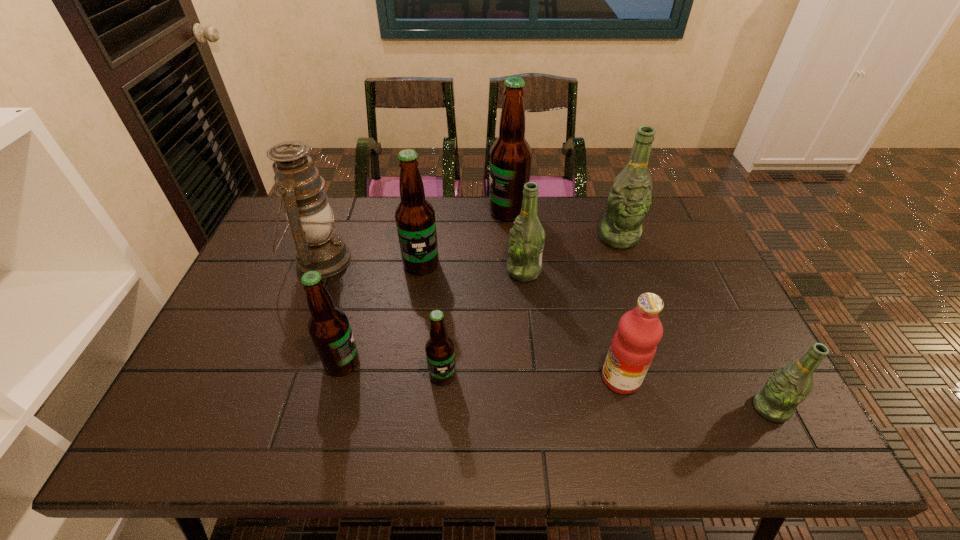
Find the location of a particular element. This screenshot has width=960, height=540. vacant region located 0.270m on the surface of the nearest green beer bottle is located at coordinates (635, 408).

Locate an element on the screen. The image size is (960, 540). free location located on the surface of the nearest green beer bottle is located at coordinates (691, 408).

Image resolution: width=960 pixels, height=540 pixels. I want to click on free space located on the surface of the nearest green beer bottle, so click(x=616, y=408).

Where is `oil lamp at the far edge`? oil lamp at the far edge is located at coordinates (298, 183).

I want to click on object that is at the near edge, so click(x=789, y=385).

The width and height of the screenshot is (960, 540). Find the location of `object located in the left edge section of the desktop`. object located in the left edge section of the desktop is located at coordinates (298, 183).

Locate an element on the screen. The width and height of the screenshot is (960, 540). object at the right edge is located at coordinates (789, 385).

Identify the location of object that is at the far left corner. (298, 183).

I want to click on object positioned at the near right corner, so click(x=789, y=385).

In the image, there is a desktop. What are the coordinates of `vacant space at the far edge` in the screenshot? It's located at (333, 229).